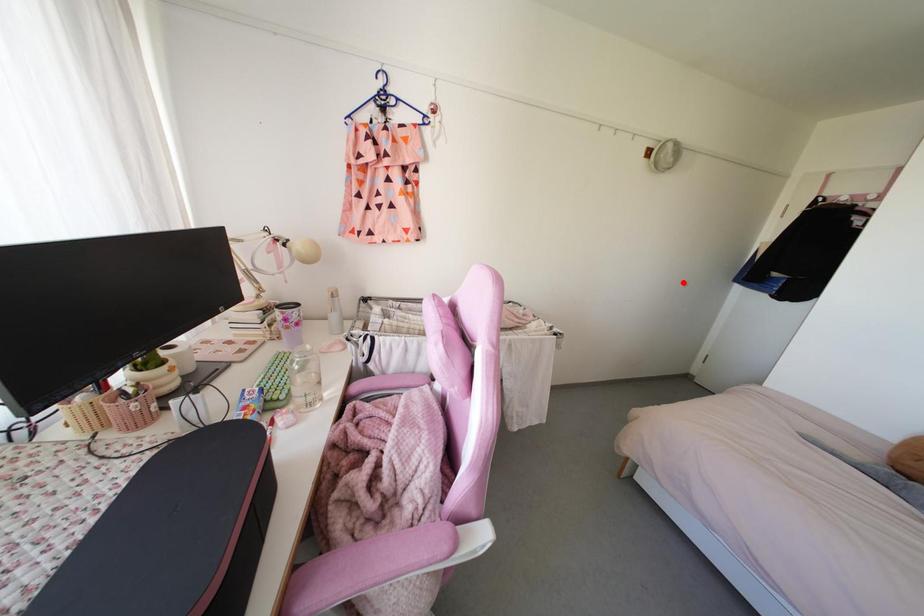
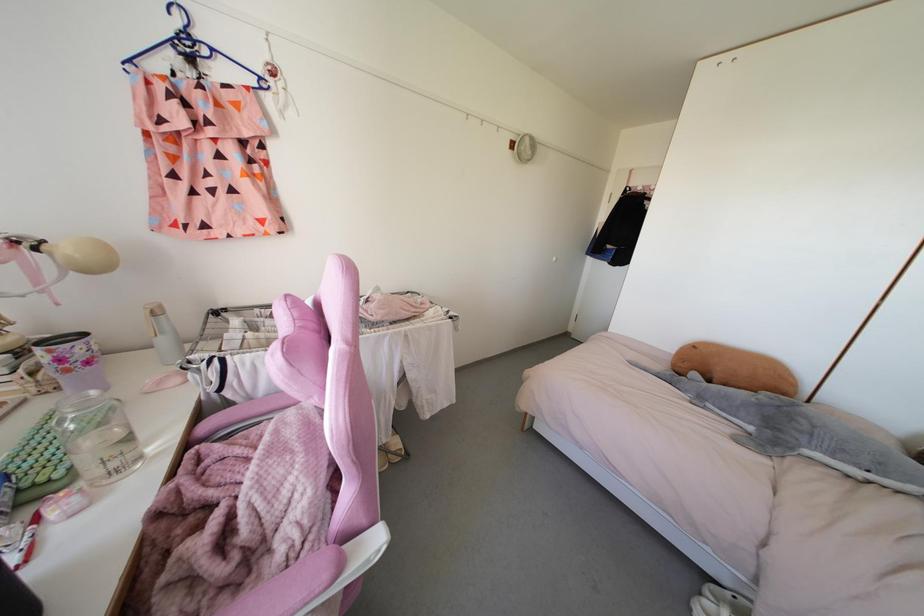
Locate, in the second image, the point that corresponds to the highlighted location in the first image.

(553, 257)